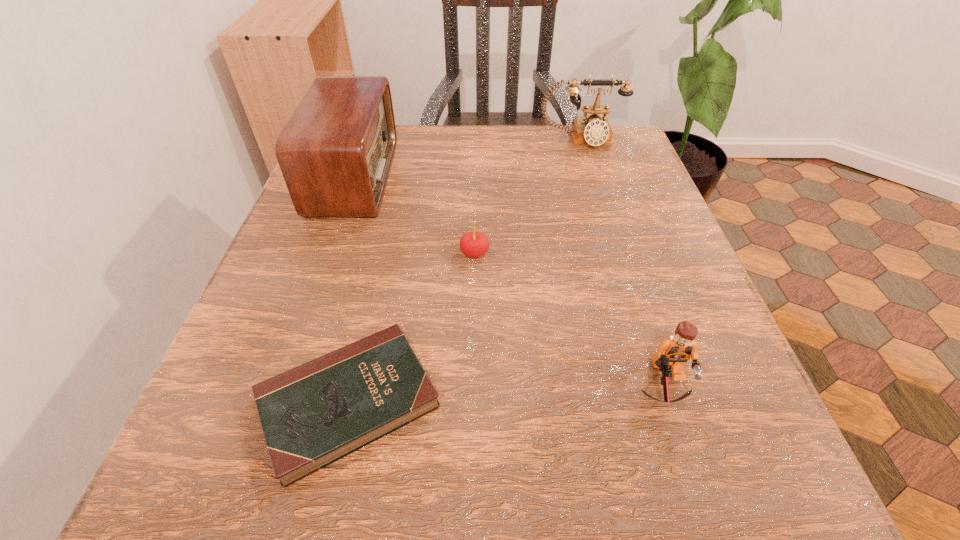
Identify the location of free space that satisfies the following two spatial constraints: 1. on the dial number of the telephone; 2. on the front panel of the radio receiver. (593, 177).

The height and width of the screenshot is (540, 960). Identify the location of free space that satisfies the following two spatial constraints: 1. on the back side of the shortest object; 2. on the front panel of the radio receiver. (399, 177).